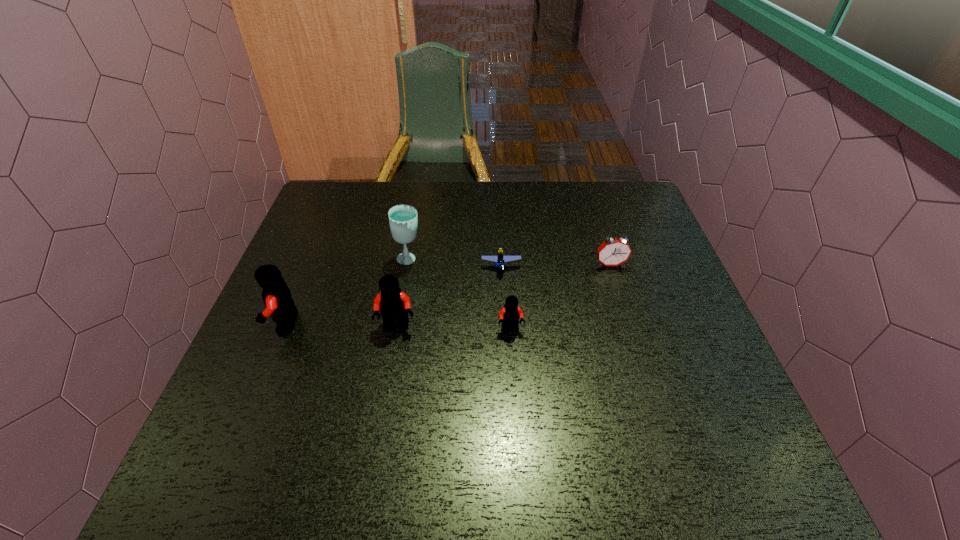
In order to click on Lego that is the third closest one to the second shortest Lego in this screenshot , I will do `click(276, 295)`.

The height and width of the screenshot is (540, 960). Identify the location of vacant point that satisfies the following two spatial constraints: 1. on the front-facing side of the shortest Lego; 2. on the front-facing side of the leftmost Lego. (504, 323).